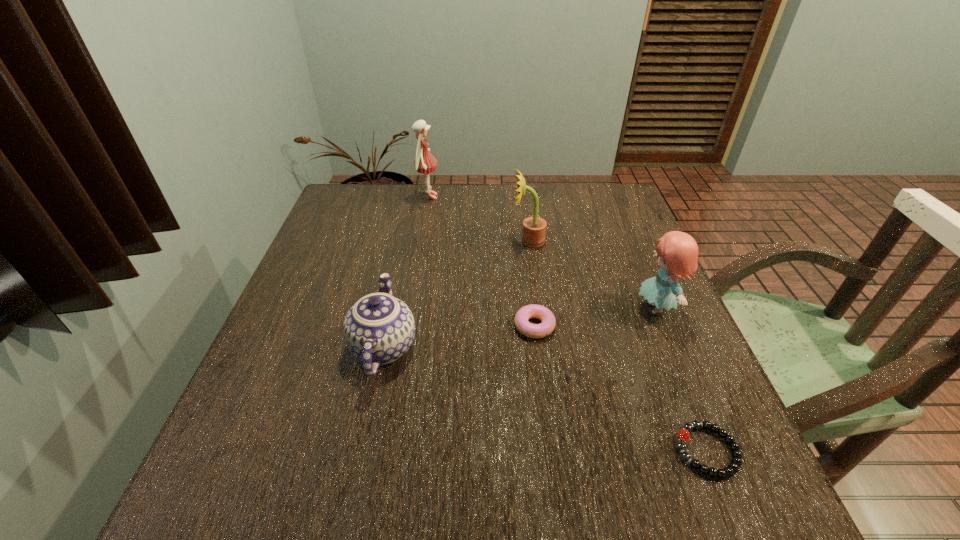
Image resolution: width=960 pixels, height=540 pixels. What are the coordinates of `object that is the fourth closest to the sunflower` in the screenshot? It's located at (378, 329).

Image resolution: width=960 pixels, height=540 pixels. What are the coordinates of `vacant space that satisfies the following two spatial constraints: 1. on the front-facing side of the farthest object; 2. on the left side of the shortest object` in the screenshot? It's located at (384, 451).

At what (x,y) coordinates should I click in order to perform the action: click on free space that satisfies the following two spatial constraints: 1. on the face of the sunflower; 2. on the left side of the shortest object. Please return your answer as a coordinate pair (x, y). The image size is (960, 540). Looking at the image, I should click on (557, 451).

Where is `vacant space that satisfies the following two spatial constraints: 1. on the front-facing side of the taller doll; 2. on the back side of the shortest object`? The height and width of the screenshot is (540, 960). vacant space that satisfies the following two spatial constraints: 1. on the front-facing side of the taller doll; 2. on the back side of the shortest object is located at coordinates (384, 451).

Find the location of a particular element. The width and height of the screenshot is (960, 540). free space that satisfies the following two spatial constraints: 1. on the face of the bracelet; 2. on the right side of the second farthest object is located at coordinates (557, 451).

At what (x,y) coordinates should I click in order to perform the action: click on free space in the image that satisfies the following two spatial constraints: 1. on the front-facing side of the taller doll; 2. on the right side of the doughnut. Please return your answer as a coordinate pair (x, y). Looking at the image, I should click on (406, 326).